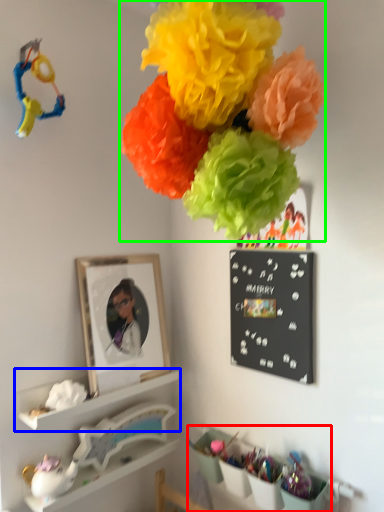
Question: Which is farther away from shelf (highlighted by a red box)? shelf (highlighted by a blue box) or flower (highlighted by a green box)?

Choices:
 (A) shelf
 (B) flower

Answer: (B)